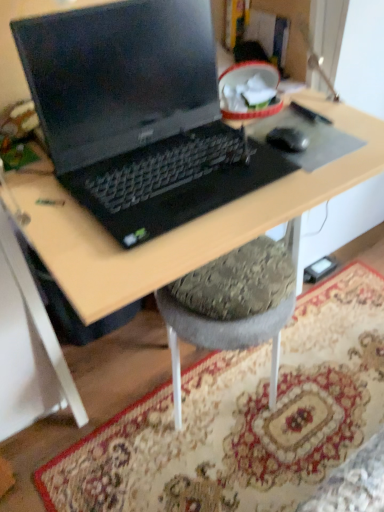
In order to click on free space above carpeted rug at lower center (from a real-world perspective) in this screenshot , I will do `click(261, 400)`.